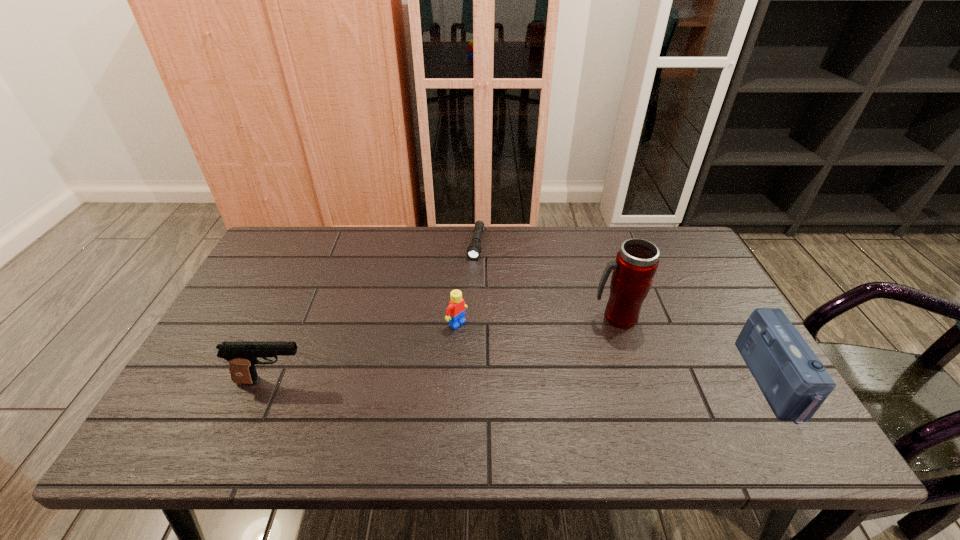
Find the location of `vacant space located 0.080m at the lens end of the shortest object`. vacant space located 0.080m at the lens end of the shortest object is located at coordinates (471, 277).

This screenshot has height=540, width=960. Identify the location of blank area located 0.290m on the face of the Lego. (551, 393).

Locate an element on the screen. Image resolution: width=960 pixels, height=540 pixels. free space located 0.290m on the face of the Lego is located at coordinates (551, 393).

This screenshot has width=960, height=540. I want to click on free space located 0.090m on the face of the Lego, so click(489, 347).

At what (x,y) coordinates should I click in order to perform the action: click on vacant area situated 0.060m on the side with the handle of the thermos bottle. Please return your answer as a coordinate pair (x, y). The image size is (960, 540). Looking at the image, I should click on (587, 338).

Where is `vacant area situated on the side with the handle of the thermos bottle`? This screenshot has width=960, height=540. vacant area situated on the side with the handle of the thermos bottle is located at coordinates (520, 392).

You are a GUI agent. You are given a task and a screenshot of the screen. Output one action in this format:
    pyautogui.click(x=<x>, y=<y>)
    Task: Click on the vacant space located on the side with the handle of the thermos bottle
    The height and width of the screenshot is (540, 960).
    Given the screenshot: What is the action you would take?
    pyautogui.click(x=530, y=384)

The image size is (960, 540). Identify the location of object at the far edge. (474, 249).

In order to click on pistol at the near edge in this screenshot , I will do `click(242, 356)`.

Where is `camera present at the near edge`? camera present at the near edge is located at coordinates (795, 383).